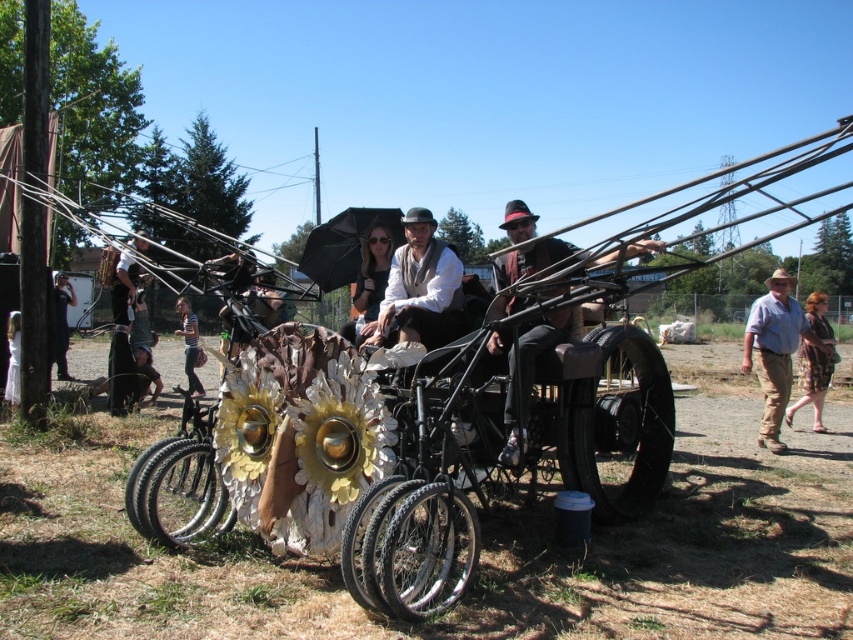
Question: Does brown/canvas pants at right have a greater width compared to matte black umbrella at center?

Choices:
 (A) no
 (B) yes

Answer: (B)

Question: Which point appears closest to the camera in this image?

Choices:
 (A) (67, 372)
 (B) (361, 284)
 (C) (822, 321)
 (D) (405, 282)

Answer: (D)

Question: Based on their relative distances, which object is farther from the white cotton dress at lower left?

Choices:
 (A) brown/canvas pants at right
 (B) striped shirt at lower left

Answer: (A)

Question: Is striped shirt at lower left bigger than white cotton dress at lower left?

Choices:
 (A) no
 (B) yes

Answer: (B)

Question: Considering the real-world distances, which object is farthest from the brown/canvas pants at right?

Choices:
 (A) matte white hat at center
 (B) black suit at left
 (C) plaid skirt at right
 (D) matte black bicycle at center

Answer: (B)

Question: Is denim jacket at left above black suit at left?

Choices:
 (A) no
 (B) yes

Answer: (A)